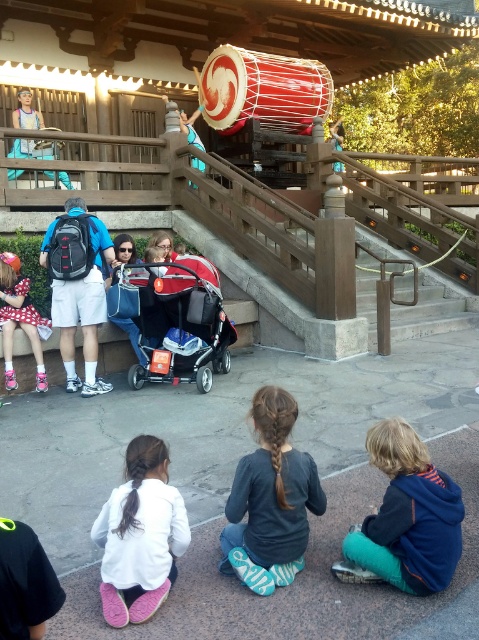
Can you confirm if dark gray shirt at center is shorter than matte black backpack at left?

Yes, dark gray shirt at center is shorter than matte black backpack at left.

Who is positioned more to the right, dark gray shirt at center or matte black backpack at left?

dark gray shirt at center

Between point (310, 506) and point (98, 305), which one is positioned in front?

Positioned in front is point (310, 506).

Where is `dark gray shirt at center`? dark gray shirt at center is located at coordinates (272, 492).

Is point (147, 451) closer to camera compared to point (239, 93)?

Yes, it is.

Is white fuzzy socks at lower left smaller than red leather drum at upper center?

Correct, white fuzzy socks at lower left occupies less space than red leather drum at upper center.

Between point (114, 618) and point (269, 93), which one is positioned behind?

Point (269, 93)

The image size is (479, 640). I want to click on white fuzzy socks at lower left, so point(139,536).

Who is taller, blue fleece jacket at lower right or red leather drum at upper center?

With more height is red leather drum at upper center.

Where is `blue fleece jacket at lower right`? The image size is (479, 640). blue fleece jacket at lower right is located at coordinates (408, 515).

Which is in front, point (413, 582) or point (205, 120)?

Point (413, 582) is more forward.

Where is `blue fleece jacket at lower right`? blue fleece jacket at lower right is located at coordinates (408, 515).